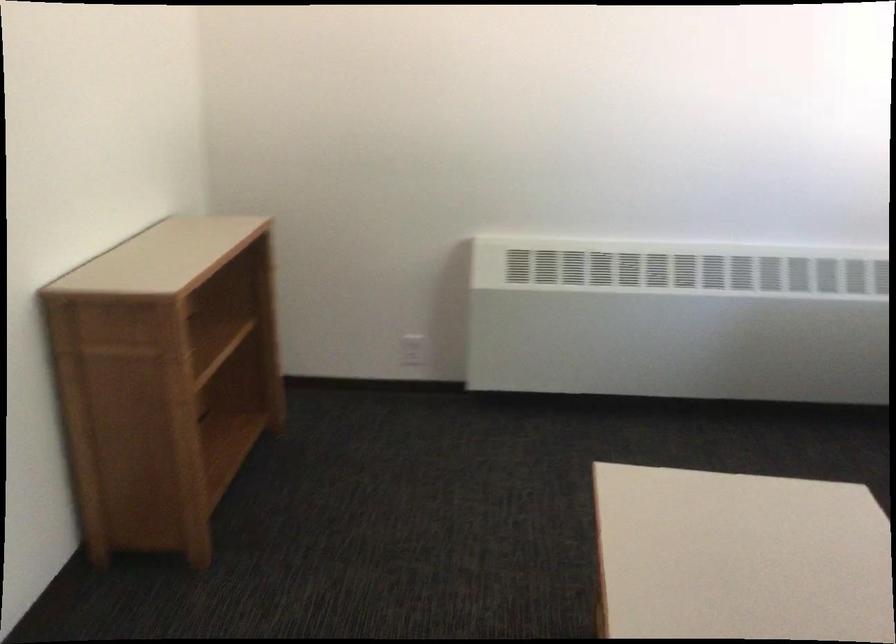
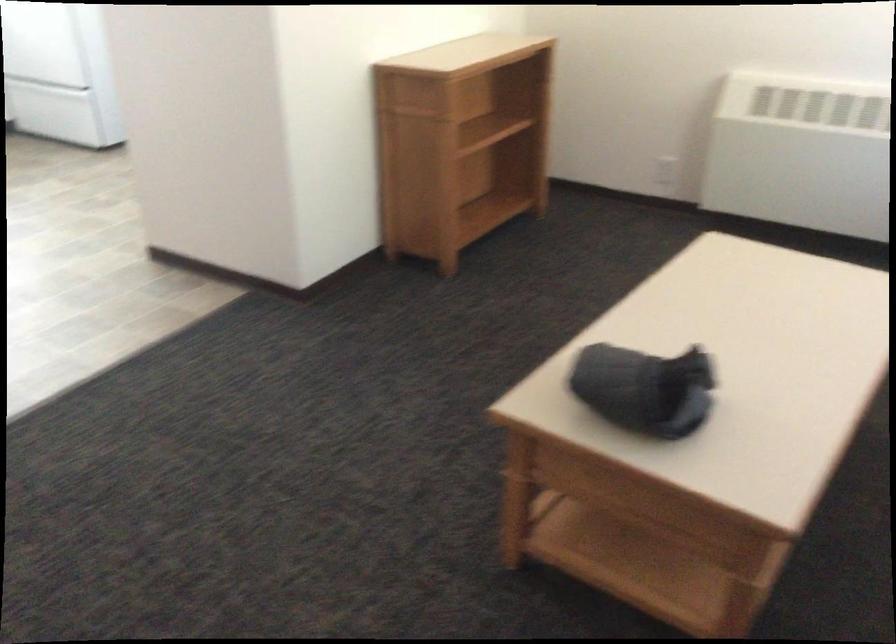
Question: The images are taken continuously from a first-person perspective. In which direction is your viewpoint rotating?

Choices:
 (A) Left
 (B) Right
 (C) Up
 (D) Down

Answer: (A)